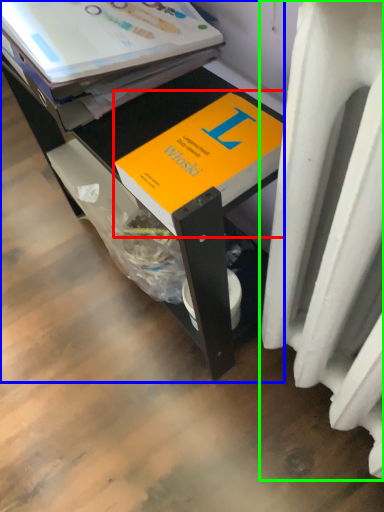
Question: Which object is positioned closest to book (highlighted by a red box)? Select from desk (highlighted by a blue box) and heater (highlighted by a green box).

Choices:
 (A) desk
 (B) heater

Answer: (A)